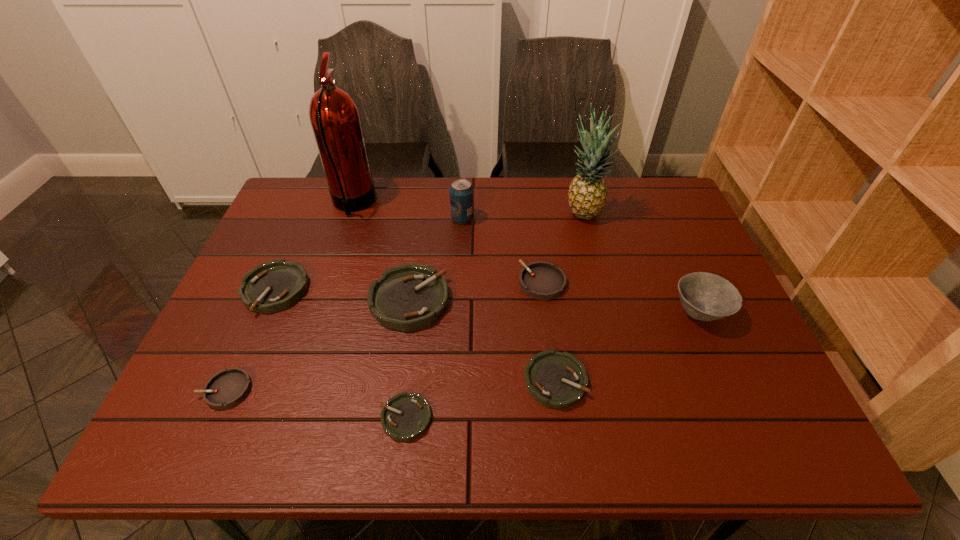
The width and height of the screenshot is (960, 540). What are the coordinates of `free space located 0.180m on the back of the biggest green ashtray` in the screenshot? It's located at (420, 229).

The image size is (960, 540). Find the location of `free space located 0.380m on the right of the right gray ashtray`. free space located 0.380m on the right of the right gray ashtray is located at coordinates (708, 283).

In order to click on blank space located on the back of the third smallest green ashtray in this screenshot , I will do `click(314, 202)`.

Find the location of a particular element. free space located 0.290m on the back of the left gray ashtray is located at coordinates (276, 278).

Find the location of a particular element. This screenshot has height=540, width=960. vacant space situated on the right of the second smallest green ashtray is located at coordinates (751, 381).

Identify the location of vacant area located 0.260m on the right of the smallest green ashtray. (559, 417).

The width and height of the screenshot is (960, 540). I want to click on fire extinguisher at the far edge, so click(334, 116).

Find the location of a particular element. This screenshot has height=540, width=960. pineapple present at the far edge is located at coordinates (587, 196).

Identify the location of pop soda positioned at the far edge. (461, 192).

At what (x,y) coordinates should I click in order to perform the action: click on object that is at the near edge. Please return your answer as a coordinate pair (x, y). This screenshot has height=540, width=960. Looking at the image, I should click on (406, 416).